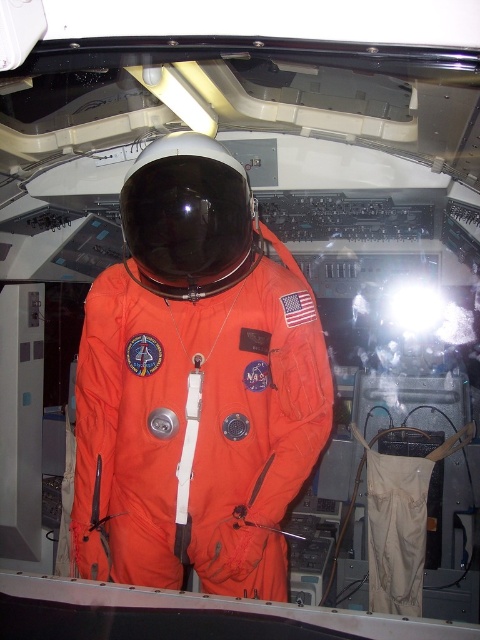
Is orange fabric astronaut at center shorter than black matte helmet at center?

Incorrect, orange fabric astronaut at center's height does not fall short of black matte helmet at center's.

Image resolution: width=480 pixels, height=640 pixels. What do you see at coordinates (194, 385) in the screenshot?
I see `orange fabric astronaut at center` at bounding box center [194, 385].

The image size is (480, 640). What do you see at coordinates (194, 385) in the screenshot? I see `orange fabric astronaut at center` at bounding box center [194, 385].

Find the location of `orange fabric astronaut at center`. orange fabric astronaut at center is located at coordinates (194, 385).